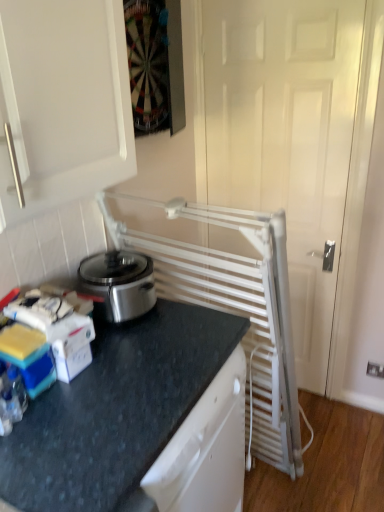
Question: Considering the relative sizes of white metallic radiator at right and white plastic electric outlet at lower right in the image provided, is white metallic radiator at right wider than white plastic electric outlet at lower right?

Choices:
 (A) no
 (B) yes

Answer: (B)

Question: Considering the relative sizes of white metallic radiator at right and white plastic electric outlet at lower right in the image provided, is white metallic radiator at right bigger than white plastic electric outlet at lower right?

Choices:
 (A) yes
 (B) no

Answer: (A)

Question: From a real-world perspective, is white metallic radiator at right under white plastic electric outlet at lower right?

Choices:
 (A) no
 (B) yes

Answer: (A)

Question: Does white metallic radiator at right lie in front of white plastic electric outlet at lower right?

Choices:
 (A) yes
 (B) no

Answer: (A)

Question: Is white metallic radiator at right positioned with its back to white plastic electric outlet at lower right?

Choices:
 (A) yes
 (B) no

Answer: (B)

Question: Does point (46, 450) appear closer or farther from the camera than point (370, 367)?

Choices:
 (A) farther
 (B) closer

Answer: (B)

Question: From the image's perspective, is black granite countertop at lower left above or below white plastic electric outlet at lower right?

Choices:
 (A) below
 (B) above

Answer: (A)

Question: Considering their positions, is black granite countertop at lower left located in front of or behind white plastic electric outlet at lower right?

Choices:
 (A) front
 (B) behind

Answer: (A)

Question: Is black granite countertop at lower left situated inside white plastic electric outlet at lower right or outside?

Choices:
 (A) inside
 (B) outside

Answer: (B)

Question: Visually, is white metallic radiator at right positioned to the left or to the right of white plastic electric outlet at lower right?

Choices:
 (A) right
 (B) left

Answer: (B)

Question: Based on their sizes in the image, would you say white metallic radiator at right is bigger or smaller than white plastic electric outlet at lower right?

Choices:
 (A) small
 (B) big

Answer: (B)

Question: Is white metallic radiator at right inside the boundaries of white plastic electric outlet at lower right, or outside?

Choices:
 (A) inside
 (B) outside

Answer: (B)

Question: Considering their positions, is white metallic radiator at right located in front of or behind white plastic electric outlet at lower right?

Choices:
 (A) behind
 (B) front

Answer: (B)

Question: Considering the positions of point (369, 371) and point (319, 343), is point (369, 371) closer or farther from the camera than point (319, 343)?

Choices:
 (A) closer
 (B) farther

Answer: (A)

Question: From a real-world perspective, is white plastic electric outlet at lower right physically located above or below white metallic radiator at right?

Choices:
 (A) above
 (B) below

Answer: (B)